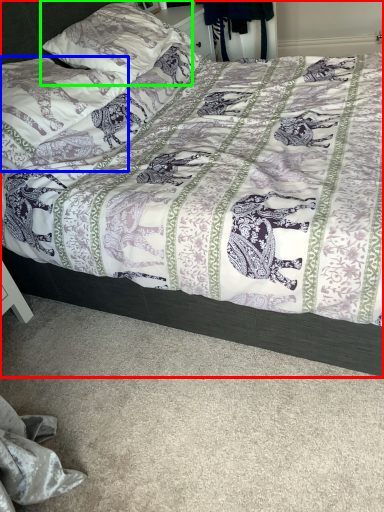
Question: Which is nearer to the bed (highlighted by a red box)? pillow (highlighted by a blue box) or pillow (highlighted by a green box).

Choices:
 (A) pillow
 (B) pillow

Answer: (A)